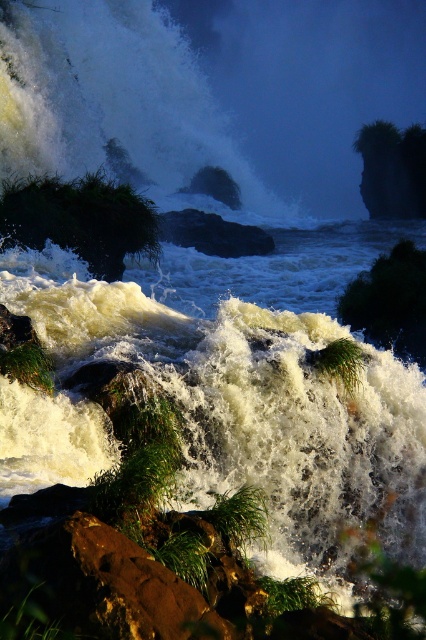
Question: Which point is farther from the camera taking this photo?

Choices:
 (A) click(368, 131)
 (B) click(279, 349)
 (C) click(408, 305)
 (D) click(120, 268)

Answer: (A)

Question: Which point is closer to the camera?

Choices:
 (A) white frothy water at upper left
 (B) white frothy water at center

Answer: (B)

Question: Observing the image, what is the correct spatial positioning of white frothy water at center in reference to green grassy rock at upper right?

Choices:
 (A) right
 (B) left

Answer: (B)

Question: Is white frothy water at upper left smaller than green grassy rock at upper right?

Choices:
 (A) yes
 (B) no

Answer: (B)

Question: Which object appears farthest from the camera in this image?

Choices:
 (A) white frothy water at upper left
 (B) green grassy rock at upper right
 (C) green leafy tree at lower right
 (D) white frothy water at center

Answer: (B)

Question: From the image, what is the correct spatial relationship of green grassy bush at left in relation to green grassy rock at upper right?

Choices:
 (A) right
 (B) left

Answer: (B)